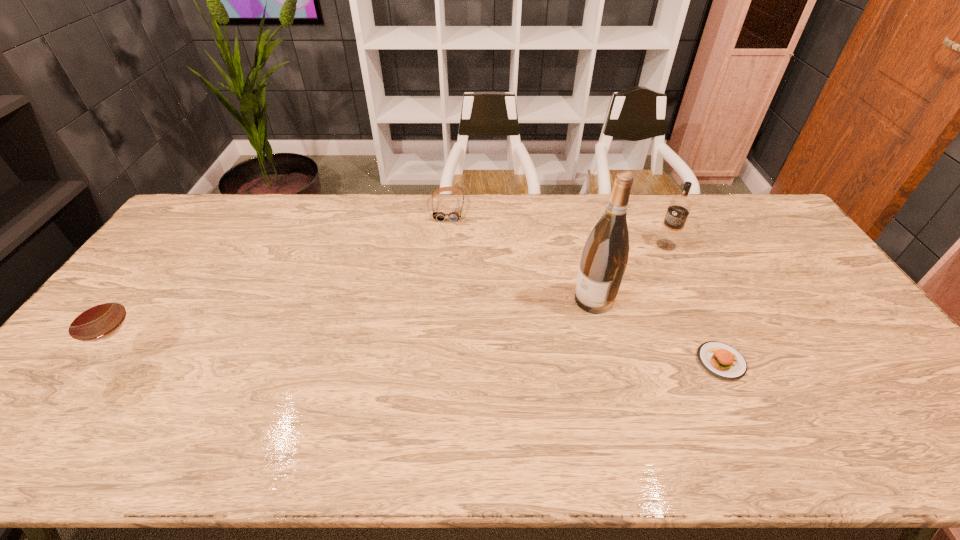
Identify the location of vacant area that lies between the vodka and the shortest object. pos(693,303).

Find the location of `vacant point located between the fourth nearest object and the third farthest object`. vacant point located between the fourth nearest object and the third farthest object is located at coordinates (630, 272).

Find the location of a particular element. The height and width of the screenshot is (540, 960). free space between the third farthest object and the vodka is located at coordinates (630, 272).

This screenshot has width=960, height=540. I want to click on free space between the tallest object and the fourth object from right to left, so click(521, 254).

I want to click on free space that is in between the goggles and the second tallest object, so click(557, 226).

What are the coordinates of `vacant region between the second shortest object and the second farthest object` in the screenshot? It's located at (557, 226).

Where is `blank region between the third tallest object and the vodka`? This screenshot has height=540, width=960. blank region between the third tallest object and the vodka is located at coordinates (400, 303).

The image size is (960, 540). Identify the location of vacant space that's between the vodka and the wine bottle. click(630, 272).

I want to click on vacant area that lies between the food and the leftmost object, so click(x=427, y=362).

Where is `object that is the fourth closest to the vodka`? object that is the fourth closest to the vodka is located at coordinates (96, 316).